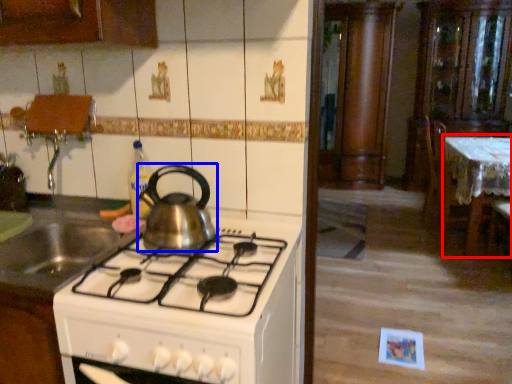
Question: Which object appears closest to the camera in this image, table (highlighted by a red box) or kitchen appliance (highlighted by a blue box)?

Choices:
 (A) table
 (B) kitchen appliance

Answer: (B)